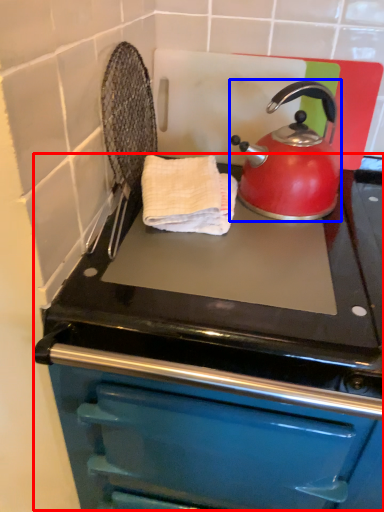
Question: Among these objects, which one is nearest to the camera, oven (highlighted by a red box) or kettle (highlighted by a blue box)?

Choices:
 (A) oven
 (B) kettle

Answer: (A)